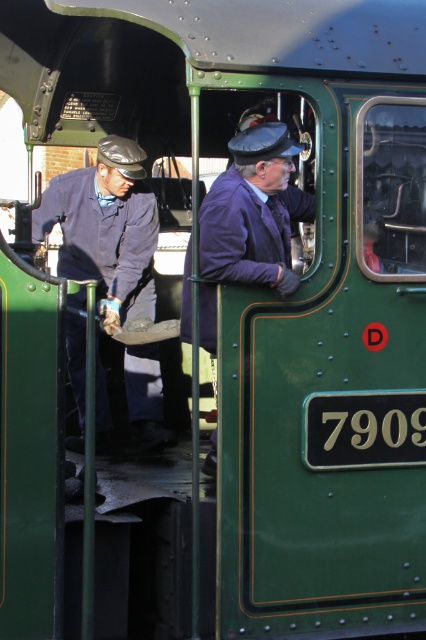
Question: Considering the relative positions of blue fabric uniform at center and purple woolen jacket at center in the image provided, where is blue fabric uniform at center located with respect to purple woolen jacket at center?

Choices:
 (A) below
 (B) above

Answer: (A)

Question: Among these objects, which one is nearest to the camera?

Choices:
 (A) purple woolen jacket at center
 (B) blue fabric uniform at center

Answer: (A)

Question: Is blue fabric uniform at center positioned behind purple woolen jacket at center?

Choices:
 (A) no
 (B) yes

Answer: (B)

Question: Does blue fabric uniform at center have a lesser width compared to purple woolen jacket at center?

Choices:
 (A) yes
 (B) no

Answer: (B)

Question: Which point appears closest to the camera in this image?

Choices:
 (A) (158, 420)
 (B) (189, 326)

Answer: (B)